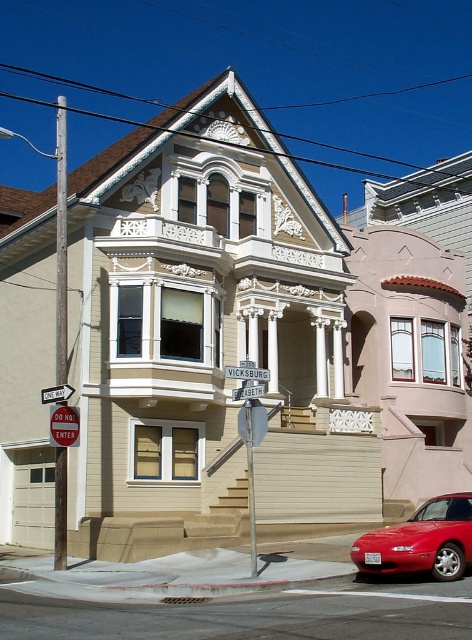
Question: Is shiny red car at lower right positioned behind red plastic stop sign at center?

Choices:
 (A) no
 (B) yes

Answer: (A)

Question: Is shiny red car at lower right below white plastic one-way sign at upper center?

Choices:
 (A) yes
 (B) no

Answer: (A)

Question: Estimate the real-world distances between objects in this image. Which object is closer to the shiny red car at lower right?

Choices:
 (A) white plastic one-way sign at upper center
 (B) white metal street sign at upper center
 (C) red plastic stop sign at center
 (D) metallic pole at left

Answer: (B)

Question: Among these points, which one is farthest from the camera?

Choices:
 (A) (72, 387)
 (B) (384, 534)
 (C) (244, 374)
 (D) (252, 397)

Answer: (A)

Question: Observing the image, what is the correct spatial positioning of shiny red car at lower right in reference to white wooden street sign at upper center?

Choices:
 (A) above
 (B) below

Answer: (B)

Question: Among these objects, which one is nearest to the camera?

Choices:
 (A) white metal street sign at upper center
 (B) white plastic one-way sign at upper center

Answer: (A)